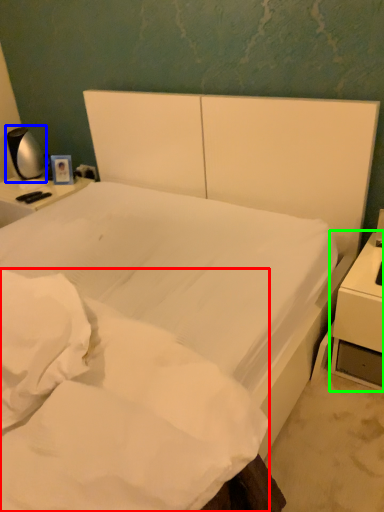
Question: Considering the real-world distances, which object is farthest from mattress (highlighted by a red box)? bedside lamp (highlighted by a blue box) or nightstand (highlighted by a green box)?

Choices:
 (A) bedside lamp
 (B) nightstand

Answer: (A)